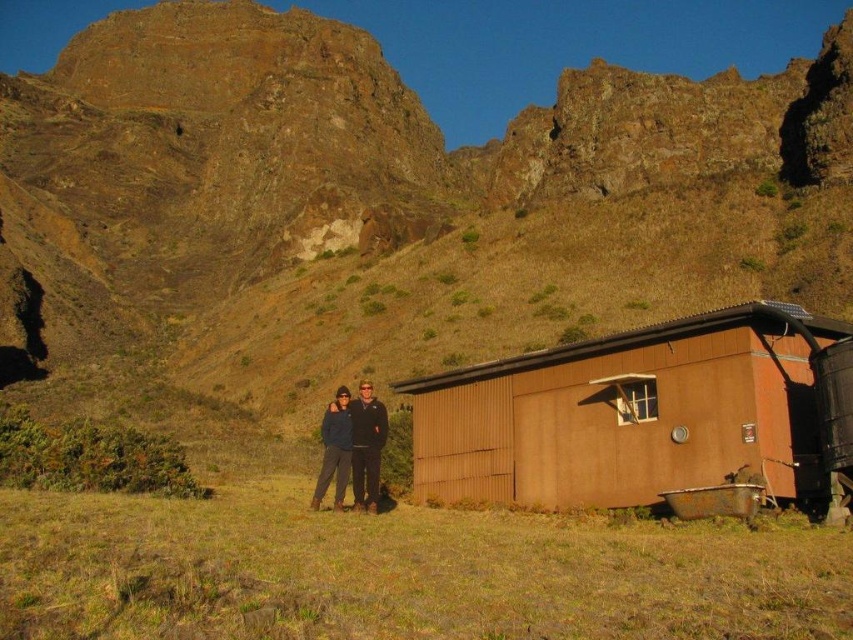
You are standing at the position of point (x=328, y=468) and want to move to the cabin. Is the cabin in front of or behind point (x=503, y=499)?

The cabin is in front of point (x=503, y=499) because point (x=503, y=499) is behind point (x=328, y=468), and the cabin is located in front of both points.

You are standing in the mountainous area and want to take a photo of the brown corrugated metal cabin at right and the dark blue jacket at center. Which object should you focus on first if you want to capture both in sharp focus?

The brown corrugated metal cabin at right is closer to the viewer than the dark blue jacket at center, so you should focus on the cabin first to ensure both are in focus.

You are standing in the rustic outdoor setting and want to take a photo of the brown corrugated metal cabin at right and the dark blue jacket at center. Which object should you position closer to the left side of the camera frame?

The dark blue jacket at center should be positioned closer to the left side of the camera frame since the brown corrugated metal cabin at right is on its right side.